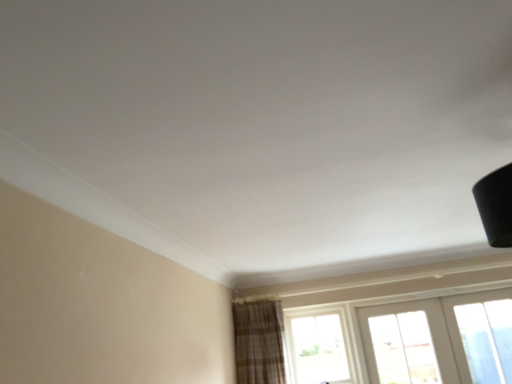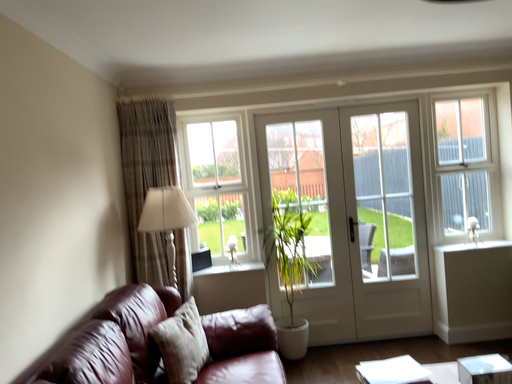
Question: Which way did the camera rotate in the video?

Choices:
 (A) rotated left
 (B) rotated right

Answer: (B)